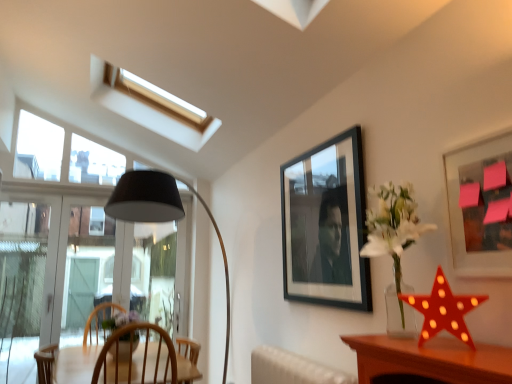
The image size is (512, 384). I want to click on blank space above black matte picture frame at upper center, placed as the first picture frame when sorted from back to front (from a real-world perspective), so click(313, 150).